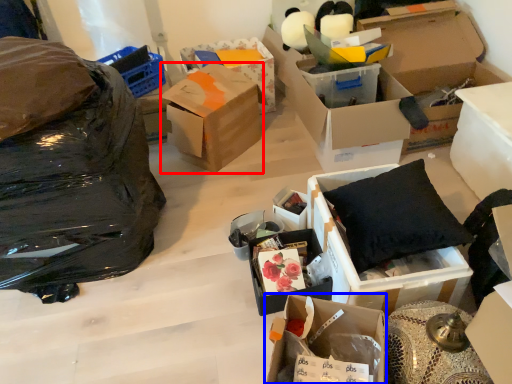
Question: Which object appears closest to the camera in this image, box (highlighted by a red box) or box (highlighted by a blue box)?

Choices:
 (A) box
 (B) box

Answer: (B)